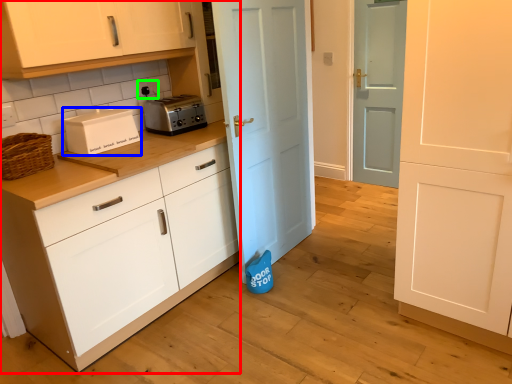
Question: Considering the real-world distances, which object is closest to cabinetry (highlighted by a red box)? home appliance (highlighted by a blue box) or electric outlet (highlighted by a green box).

Choices:
 (A) home appliance
 (B) electric outlet

Answer: (A)